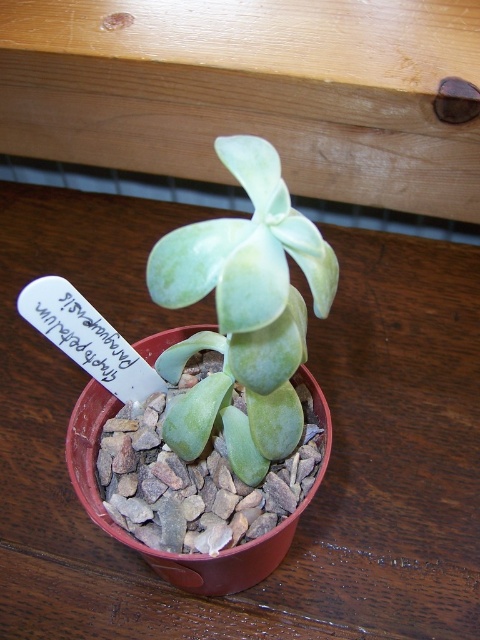
Question: Which point is farther to the camera?

Choices:
 (A) gray gravel at center
 (B) green succulent at center

Answer: (A)

Question: Is green succulent at center thinner than gray gravel at center?

Choices:
 (A) no
 (B) yes

Answer: (B)

Question: In this image, where is green succulent at center located relative to gray gravel at center?

Choices:
 (A) right
 (B) left

Answer: (A)

Question: Among these objects, which one is nearest to the camera?

Choices:
 (A) green succulent at center
 (B) gray gravel at center

Answer: (A)

Question: From the image, what is the correct spatial relationship of green succulent at center in relation to gray gravel at center?

Choices:
 (A) right
 (B) left

Answer: (A)